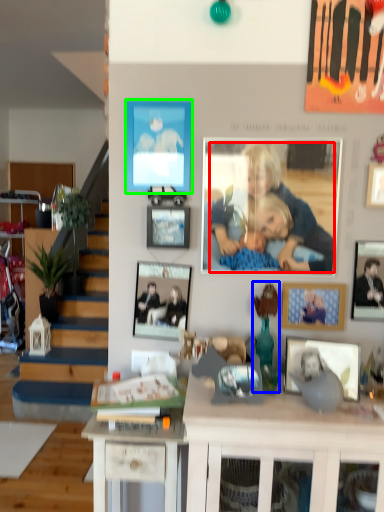
Question: Estimate the real-world distances between objects in this image. Which object is closer to person (highlighted by a red box), toy (highlighted by a blue box) or picture frame (highlighted by a green box)?

Choices:
 (A) toy
 (B) picture frame

Answer: (B)